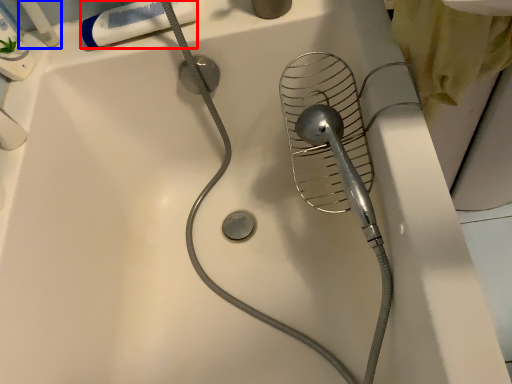
Question: Which of the following is the farthest to the observer, toothpaste (highlighted by a red box) or toiletry (highlighted by a blue box)?

Choices:
 (A) toothpaste
 (B) toiletry

Answer: (A)